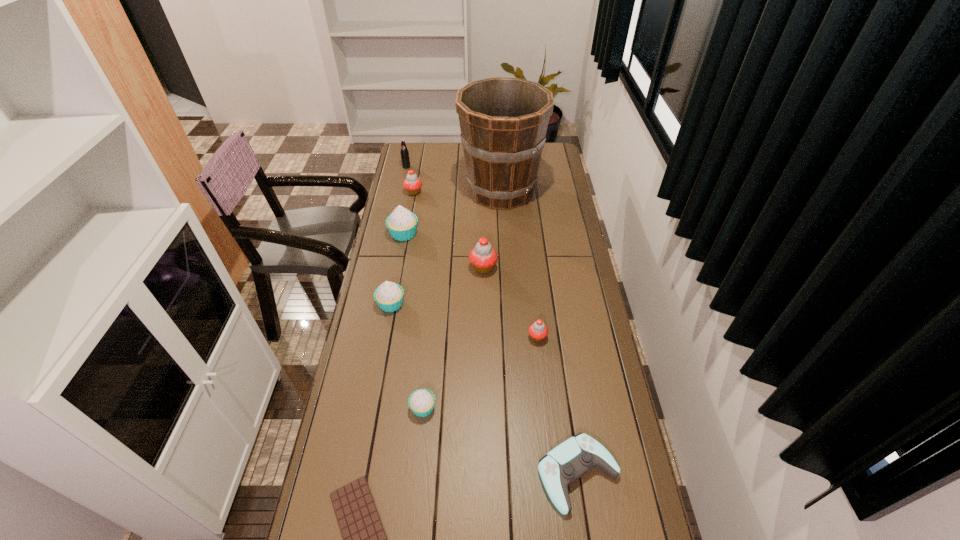
Identify which object is the seventh nearest to the control. Please provide its 2D coordinates. Your answer should be formatted as a tuple, i.e. [(x, y)], where the tuple contains the x and y coordinates of a point satisfying the conditions above.

[(503, 121)]

Where is `cupcake that stands as the second closest to the control`? This screenshot has height=540, width=960. cupcake that stands as the second closest to the control is located at coordinates (538, 331).

Where is `the closest cupcake relative to the second biggest white cupcake`? The height and width of the screenshot is (540, 960). the closest cupcake relative to the second biggest white cupcake is located at coordinates pyautogui.click(x=483, y=257).

Locate an element on the screen. This screenshot has height=540, width=960. red cupcake that can be found as the closest to the nearest white cupcake is located at coordinates (538, 331).

This screenshot has height=540, width=960. What are the coordinates of `the second closest red cupcake to the control` in the screenshot? It's located at (483, 257).

Identify which white cupcake is the closest to the ninth tallest object. Please provide its 2D coordinates. Your answer should be formatted as a tuple, i.e. [(x, y)], where the tuple contains the x and y coordinates of a point satisfying the conditions above.

[(421, 402)]

Where is `white cupcake that stands as the second closest to the third nearest object`? This screenshot has height=540, width=960. white cupcake that stands as the second closest to the third nearest object is located at coordinates (402, 224).

Identify the location of vacant space that satisfies the following two spatial constraints: 1. on the front side of the second shortest object; 2. on the left side of the smallest red cupcake. The image size is (960, 540). (553, 474).

In order to click on free space that satisfies the following two spatial constraints: 1. on the back side of the third nearest cupcake; 2. on the right side of the farthest cupcake in this screenshot , I will do pyautogui.click(x=412, y=192).

Locate an element on the screen. This screenshot has width=960, height=540. blank space that satisfies the following two spatial constraints: 1. on the front side of the control; 2. on the left side of the third nearest object is located at coordinates (417, 474).